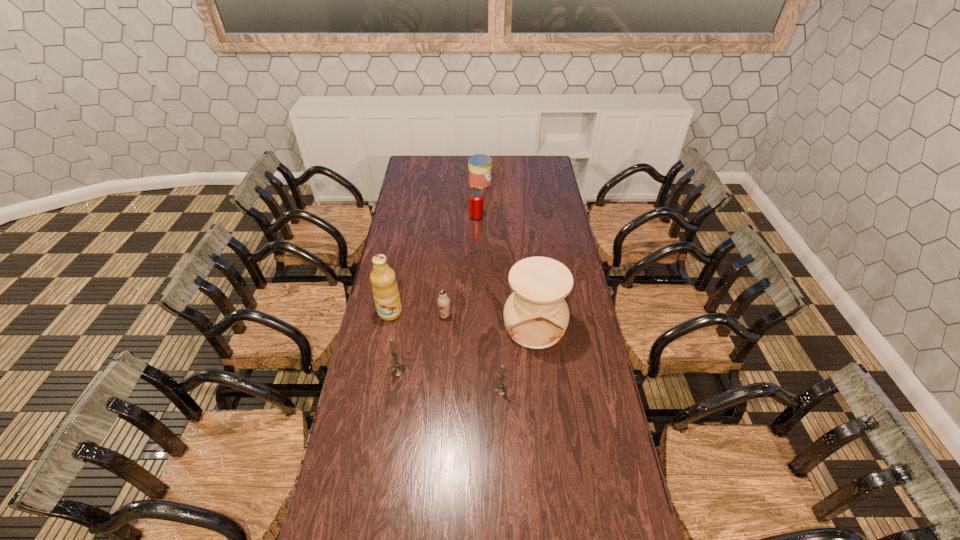
The image size is (960, 540). I want to click on blank space located on the back of the nearest object, so click(499, 333).

The height and width of the screenshot is (540, 960). In order to click on vacant space located 0.390m on the left of the nearer can in this screenshot , I will do [x=395, y=217].

Find the location of `free point located 0.360m on the front of the farthest object`. free point located 0.360m on the front of the farthest object is located at coordinates (480, 227).

Identify the location of vacant space located on the back of the chocolate milk. (447, 286).

The width and height of the screenshot is (960, 540). In order to click on vacant space positioned 0.200m at the open side of the pottery in this screenshot , I will do `click(542, 397)`.

At what (x,y) coordinates should I click in order to perform the action: click on vacant space positioned 0.350m on the label of the olive oil. Please return your answer as a coordinate pair (x, y). This screenshot has width=960, height=540. Looking at the image, I should click on (373, 398).

Where is `candle that is at the left edge`? candle that is at the left edge is located at coordinates (396, 370).

At what (x,y) coordinates should I click in order to perform the action: click on olive oil at the left edge. Please return your answer as a coordinate pair (x, y). This screenshot has height=540, width=960. Looking at the image, I should click on (385, 290).

Where is `object present at the right edge`? This screenshot has width=960, height=540. object present at the right edge is located at coordinates (536, 315).

Where is `vacant space at the far edge`? Image resolution: width=960 pixels, height=540 pixels. vacant space at the far edge is located at coordinates (447, 171).